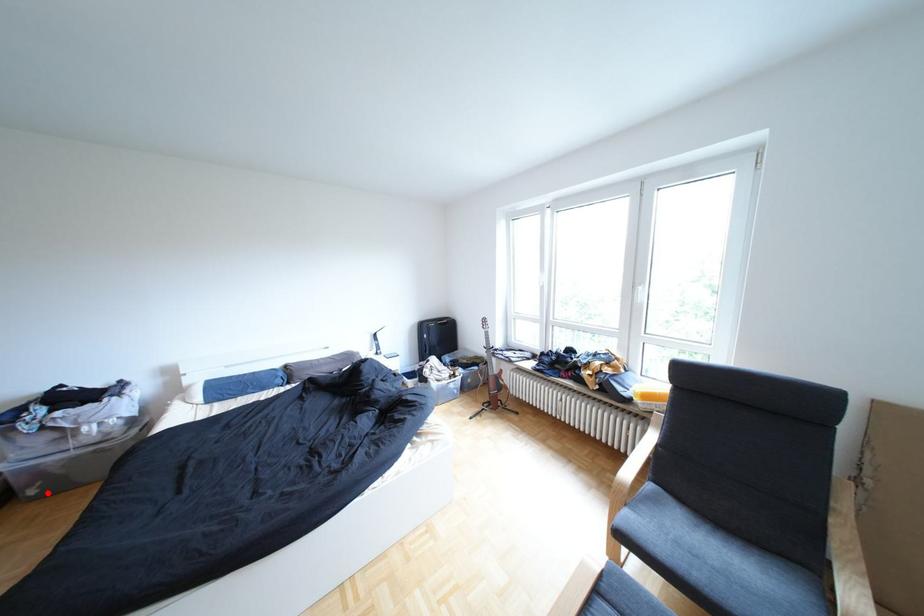
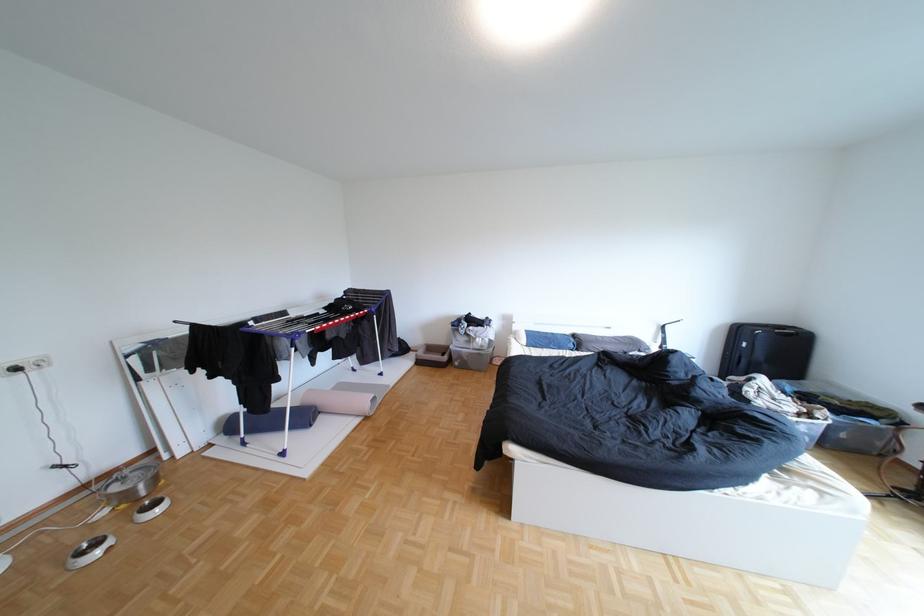
Question: I am providing you with two images of the same scene from different viewpoints. A red point is shown in image1. For the corresponding object point in image2, is it positioned nearer or farther from the camera?

Choices:
 (A) Nearer
 (B) Farther

Answer: (B)